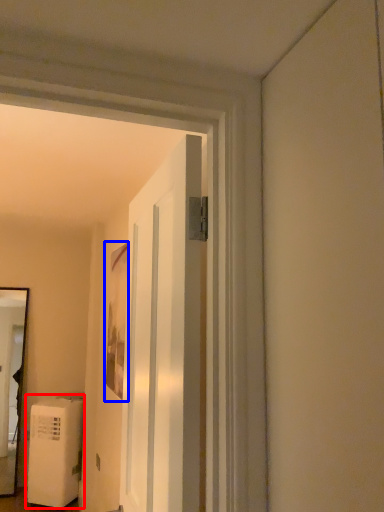
Question: Which object appears closest to the camera in this image, water heater (highlighted by a red box) or picture frame (highlighted by a blue box)?

Choices:
 (A) water heater
 (B) picture frame

Answer: (B)